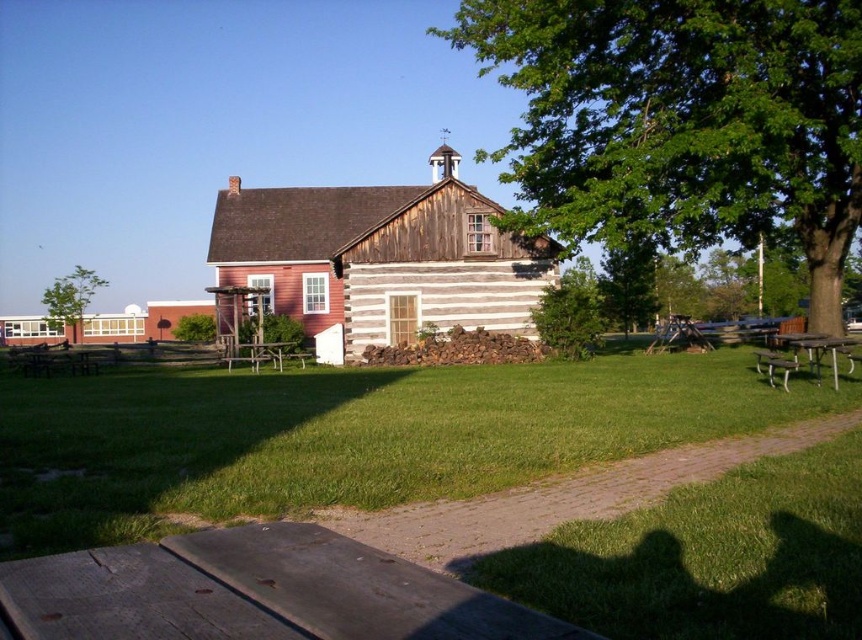
You are standing in the grassy area near the white wooden log cabin at center and want to walk to the black metal picnic table at lower right. Which direction should you move to reach it?

The white wooden log cabin at center is to the left of the black metal picnic table at lower right, so you should move to the right to reach the picnic table.